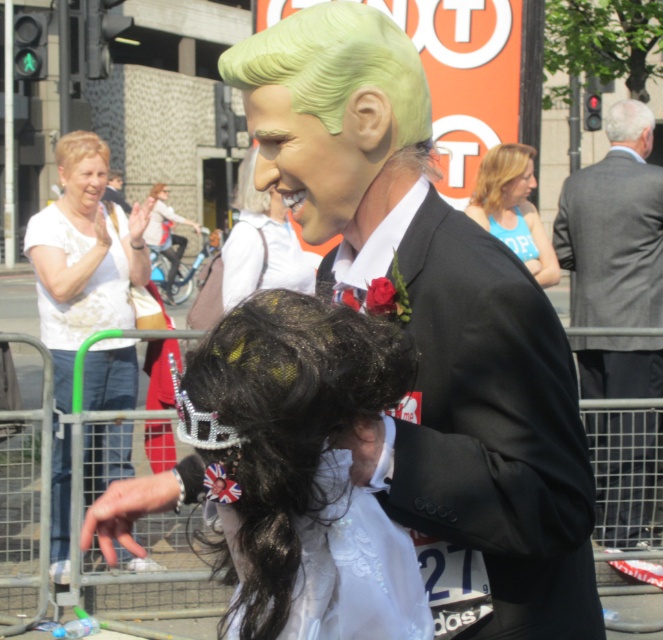
Which is more to the left, light skin tone face at upper left or white matte hair at upper right?

Positioned to the left is light skin tone face at upper left.

Does light skin tone face at upper left have a greater height compared to white matte hair at upper right?

Correct, light skin tone face at upper left is much taller as white matte hair at upper right.

Locate an element on the screen. Image resolution: width=663 pixels, height=640 pixels. light skin tone face at upper left is located at coordinates (82, 188).

In order to click on light skin tone face at upper left in this screenshot , I will do `click(82, 188)`.

In the scene shown: Is white lace shirt at left further to camera compared to light skin tone face at upper left?

That is False.

Looking at this image, can you confirm if white lace shirt at left is positioned above light skin tone face at upper left?

No, white lace shirt at left is not above light skin tone face at upper left.

Where is `white lace shirt at left`? white lace shirt at left is located at coordinates (84, 280).

Which is more to the left, blonde synthetic wig at upper center or green matte wig at upper center?

green matte wig at upper center is more to the left.

Who is more distant from viewer, (503, 164) or (391, 157)?

Positioned behind is point (503, 164).

Find the location of a particular element. blonde synthetic wig at upper center is located at coordinates (499, 173).